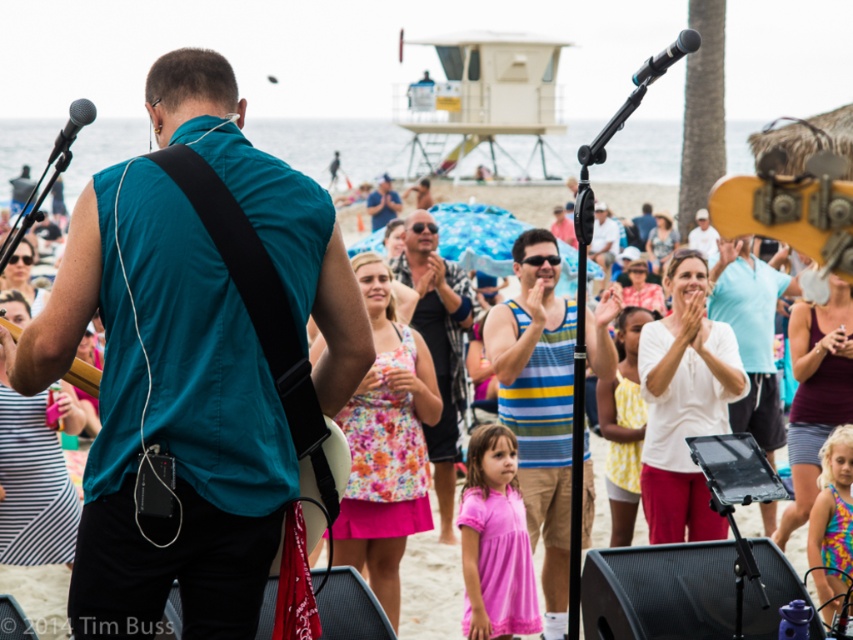
You are a photographer at the beach music event. You need to capture a photo of the musician and the floral fabric dress at center in the same frame. Based on their positions, can you confirm if both will be visible in the photo?

The floral fabric dress at center is located at point (432, 584), which is within the central area of the image. Since the musician is also positioned in the foreground, both subjects are likely to be visible in the same frame.

You are standing at the beach watching the music performance. There are two points marked in the image. If you want to walk towards the closer point between point (x=712, y=285) and point (x=312, y=484), which point should you head towards?

Point (x=312, y=484) is closer to you than point (x=712, y=285), so you should head towards point (x=312, y=484).

You are a photographer at the beach concert and want to capture both the white striped tank top at center and the teal fabric guitar at center in a single frame. Which object should you focus on first to ensure both fit in the photo?

The white striped tank top at center is wider than the teal fabric guitar at center, so focusing on the white striped tank top at center first will ensure both objects fit in the photo.